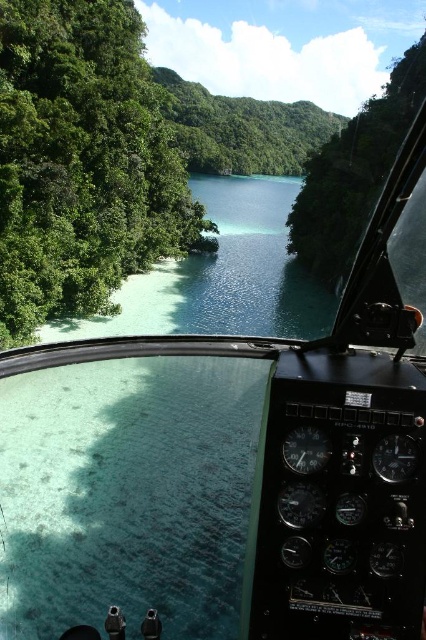
Does green leafy trees at left have a larger size compared to green leafy vegetation at center?

Yes, green leafy trees at left is bigger than green leafy vegetation at center.

Between green leafy trees at left and green leafy vegetation at center, which one appears on the left side from the viewer's perspective?

green leafy trees at left

Does point (155, 214) lie in front of point (351, 180)?

Yes, point (155, 214) is closer to viewer.

Where is `green leafy trees at left`? green leafy trees at left is located at coordinates (83, 163).